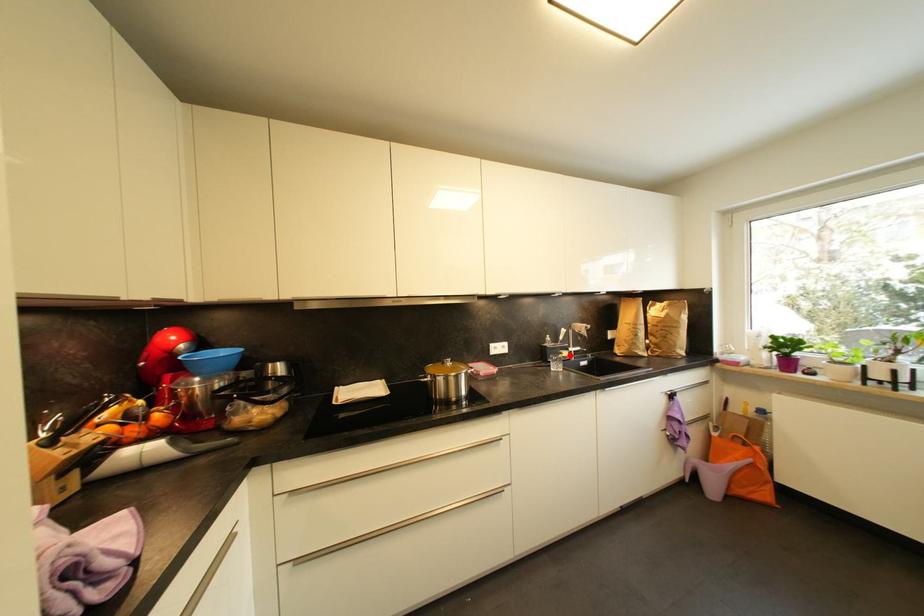
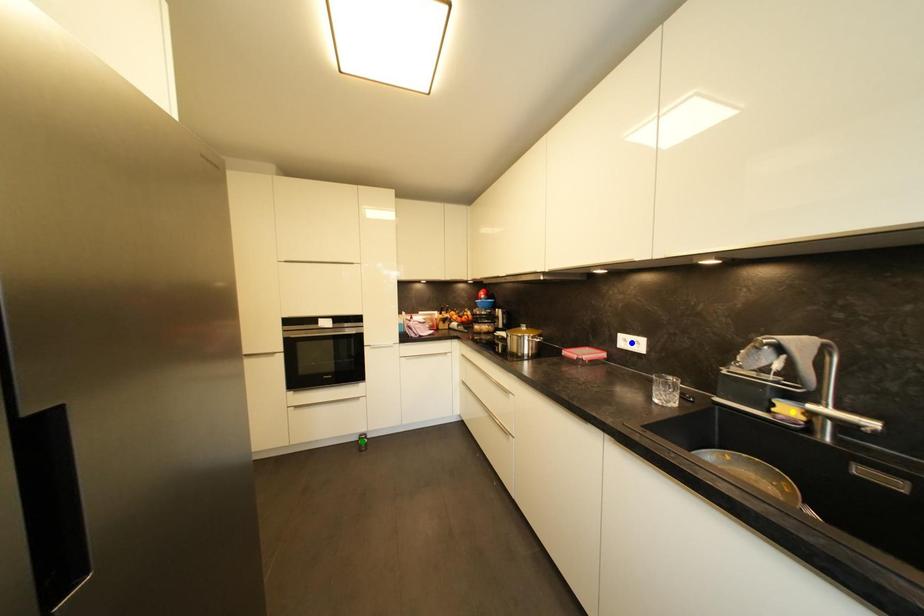
Question: I am providing you with two images of the same scene from different viewpoints. A red point is marked on the first image. You are given multiple points on the second image. Which mark in image 2 goes with the point in image 1?

Choices:
 (A) blue point
 (B) green point
 (C) yellow point

Answer: (C)